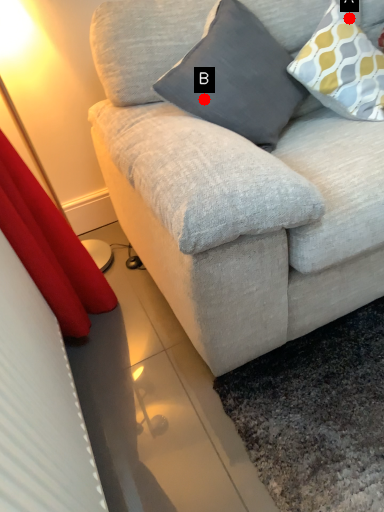
Question: Two points are circled on the image, labeled by A and B beside each circle. Which of the following is the farthest from the observer?

Choices:
 (A) A is further
 (B) B is further

Answer: (A)